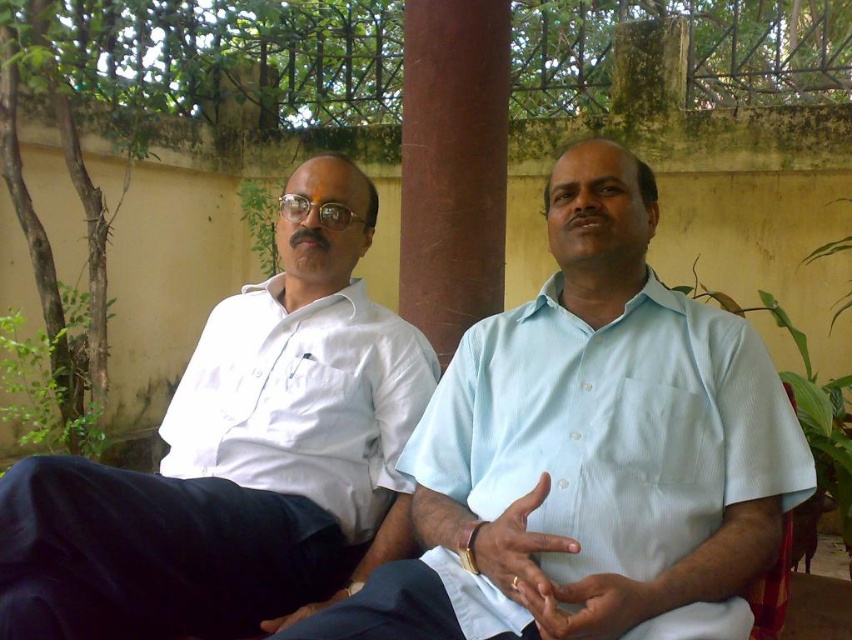
Describe the element at coordinates (612, 428) in the screenshot. I see `light blue cotton shirt at center` at that location.

Is light blue cotton shirt at center above white smooth shirt at left?

No.

Is point (648, 436) positioned before point (311, 464)?

Yes, it is.

Find the location of `light blue cotton shirt at center`. light blue cotton shirt at center is located at coordinates (612, 428).

Which is more to the left, white smooth shirt at left or brown polished wood at center?

white smooth shirt at left is more to the left.

Who is taller, white smooth shirt at left or brown polished wood at center?

brown polished wood at center is taller.

The height and width of the screenshot is (640, 852). Find the location of `white smooth shirt at left`. white smooth shirt at left is located at coordinates pos(302,401).

Is light blue cotton shirt at center below brown polished wood at center?

Correct, light blue cotton shirt at center is located below brown polished wood at center.

Between point (527, 388) and point (447, 112), which one is positioned in front?

Point (527, 388) is more forward.

The height and width of the screenshot is (640, 852). What do you see at coordinates (612, 428) in the screenshot? I see `light blue cotton shirt at center` at bounding box center [612, 428].

Where is `light blue cotton shirt at center`? The width and height of the screenshot is (852, 640). light blue cotton shirt at center is located at coordinates (612, 428).